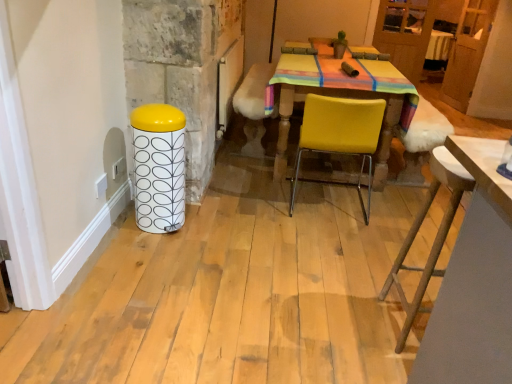
Locate an element on the screen. Image resolution: width=512 pixels, height=384 pixels. wooden table at lower right is located at coordinates (474, 282).

You are a GUI agent. You are given a task and a screenshot of the screen. Output one action in this format:
    pyautogui.click(x=<x>, y=<y>)
    Task: Click on the white glossy trash can at left
    Image resolution: width=512 pixels, height=384 pixels.
    Given the screenshot: What is the action you would take?
    pyautogui.click(x=159, y=167)

The height and width of the screenshot is (384, 512). In order to click on wooden table at lower right in this screenshot , I will do `click(474, 282)`.

Relative to white glossy trash can at left, is velvet yellow armchair at center in front or behind?

Clearly, velvet yellow armchair at center is behind white glossy trash can at left.

From a real-world perspective, is velvet yellow armchair at center above or below white glossy trash can at left?

velvet yellow armchair at center is above white glossy trash can at left.

From the image's perspective, is velvet yellow armchair at center located above white glossy trash can at left?

Indeed, from the image's perspective, velvet yellow armchair at center is shown above white glossy trash can at left.

Could white glossy trash can at left be considered to be inside velvet yellow armchair at center?

That's incorrect, white glossy trash can at left is not inside velvet yellow armchair at center.

In the scene shown: Are white glossy trash can at left and wooden table at lower right beside each other?

No, white glossy trash can at left is not in contact with wooden table at lower right.

Who is smaller, white glossy trash can at left or wooden table at lower right?

With smaller size is white glossy trash can at left.

Which object is positioned more to the left, white glossy trash can at left or wooden table at lower right?

white glossy trash can at left.

Do you think white glossy trash can at left is within wooden table at lower right, or outside of it?

white glossy trash can at left exists outside the volume of wooden table at lower right.

Based on their sizes in the image, would you say velvet yellow armchair at center is bigger or smaller than yellow matte chair at center?

velvet yellow armchair at center is smaller than yellow matte chair at center.

Which object is closer to the camera taking this photo, velvet yellow armchair at center or yellow matte chair at center?

yellow matte chair at center.

Is velvet yellow armchair at center thinner than yellow matte chair at center?

Indeed, velvet yellow armchair at center has a lesser width compared to yellow matte chair at center.

In the image, is wooden table at lower right positioned in front of or behind yellow matte chair at center?

In the image, wooden table at lower right appears in front of yellow matte chair at center.

Considering the sizes of objects wooden table at lower right and yellow matte chair at center in the image provided, who is thinner, wooden table at lower right or yellow matte chair at center?

Thinner between the two is wooden table at lower right.

Identify the location of chair directly beneath the wooden table at lower right (from a real-world perspective). The height and width of the screenshot is (384, 512). (340, 135).

Is wooden table at lower right not near yellow matte chair at center?

Yes.

From the image's perspective, which one is positioned lower, white glossy trash can at left or velvet yellow armchair at center?

From the image's view, white glossy trash can at left is below.

Image resolution: width=512 pixels, height=384 pixels. I want to click on bar stool on the left of the velvet yellow armchair at center, so click(x=159, y=167).

Is white glossy trash can at left with velvet yellow armchair at center?

They are not placed beside each other.

Between white glossy trash can at left and velvet yellow armchair at center, which one has larger width?

Wider between the two is white glossy trash can at left.

From the image's perspective, which is above, white glossy trash can at left or yellow matte chair at center?

yellow matte chair at center, from the image's perspective.

Who is taller, white glossy trash can at left or yellow matte chair at center?

yellow matte chair at center.

From a real-world perspective, does white glossy trash can at left sit lower than yellow matte chair at center?

Yes, from a real-world perspective, white glossy trash can at left is below yellow matte chair at center.

Based on their positions, is white glossy trash can at left located to the left or right of yellow matte chair at center?

Clearly, white glossy trash can at left is on the left of yellow matte chair at center in the image.

Considering the sizes of objects wooden table at lower right and white glossy trash can at left in the image provided, who is smaller, wooden table at lower right or white glossy trash can at left?

white glossy trash can at left is smaller.

Can you tell me how much wooden table at lower right and white glossy trash can at left differ in facing direction?

89.4 degrees separate the facing orientations of wooden table at lower right and white glossy trash can at left.

From the image's perspective, does wooden table at lower right appear higher than white glossy trash can at left?

No, from the image's perspective, wooden table at lower right is not over white glossy trash can at left.

In terms of width, does wooden table at lower right look wider or thinner when compared to white glossy trash can at left?

Clearly, wooden table at lower right has more width compared to white glossy trash can at left.

At what (x,y) coordinates should I click in order to perform the action: click on bar stool on the left of velvet yellow armchair at center. Please return your answer as a coordinate pair (x, y). Looking at the image, I should click on (159, 167).

Find the location of a particular element. This screenshot has width=512, height=384. table on the right of white glossy trash can at left is located at coordinates (474, 282).

From the image, which object appears to be farther from wooden table at lower right, yellow matte chair at center or velvet yellow armchair at center?

velvet yellow armchair at center.

Consider the image. Estimate the real-world distances between objects in this image. Which object is closer to velvet yellow armchair at center, white glossy trash can at left or wooden table at lower right?

white glossy trash can at left.

From the image, which object appears to be nearer to velvet yellow armchair at center, wooden table at lower right or white glossy trash can at left?

The object closer to velvet yellow armchair at center is white glossy trash can at left.

Which object lies further to the anchor point wooden table at lower right, velvet yellow armchair at center or white glossy trash can at left?

velvet yellow armchair at center lies further to wooden table at lower right than the other object.

Looking at the image, which one is located closer to velvet yellow armchair at center, yellow matte chair at center or white glossy trash can at left?

yellow matte chair at center.

When comparing their distances from white glossy trash can at left, does velvet yellow armchair at center or yellow matte chair at center seem closer?

yellow matte chair at center.

From the image, which object appears to be farther from yellow matte chair at center, wooden table at lower right or velvet yellow armchair at center?

wooden table at lower right is positioned further to the anchor yellow matte chair at center.

Looking at the image, which one is located closer to wooden table at lower right, white glossy trash can at left or velvet yellow armchair at center?

white glossy trash can at left is positioned closer to the anchor wooden table at lower right.

Where is `chair located between wooden table at lower right and velvet yellow armchair at center in the depth direction`? chair located between wooden table at lower right and velvet yellow armchair at center in the depth direction is located at coordinates tap(340, 135).

Find the location of a particular element. The height and width of the screenshot is (384, 512). chair situated between white glossy trash can at left and wooden table at lower right from left to right is located at coordinates (340, 135).

You are a GUI agent. You are given a task and a screenshot of the screen. Output one action in this format:
    pyautogui.click(x=<x>, y=<y>)
    Task: Click on the bar stool between wooden table at lower right and velvet yellow armchair at center along the z-axis
    This screenshot has width=512, height=384.
    Given the screenshot: What is the action you would take?
    pyautogui.click(x=159, y=167)

The image size is (512, 384). In order to click on chair located between white glossy trash can at left and velvet yellow armchair at center in the left-right direction in this screenshot , I will do `click(340, 135)`.